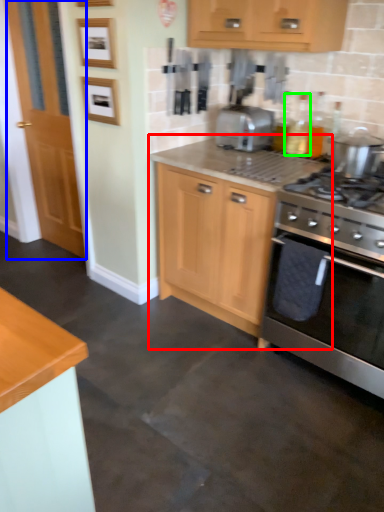
Question: Estimate the real-world distances between objects in this image. Which object is closer to cabinetry (highlighted by a red box), door (highlighted by a blue box) or bottle (highlighted by a green box)?

Choices:
 (A) door
 (B) bottle

Answer: (B)